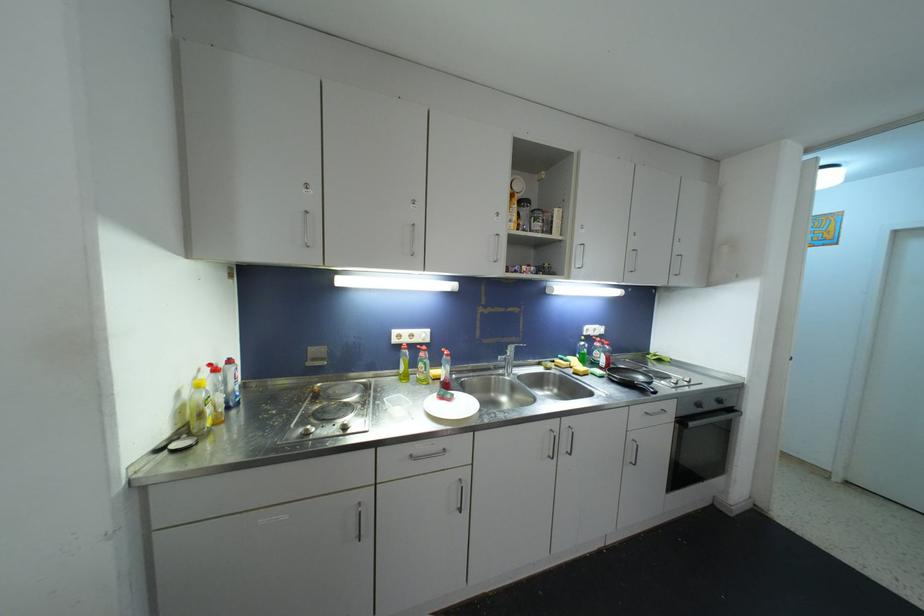
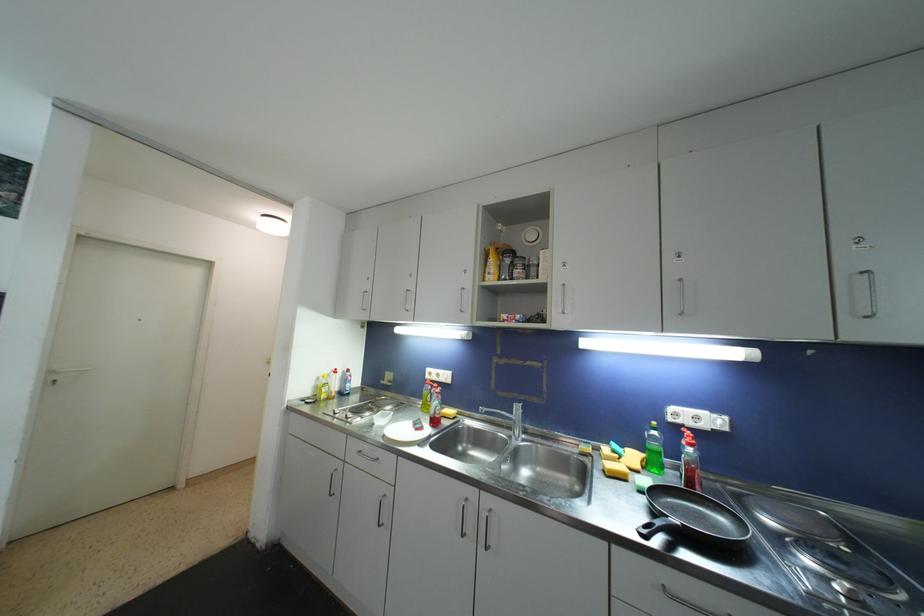
The point at (578, 377) is marked in the first image. Where is the corresponding point in the second image?

(608, 474)